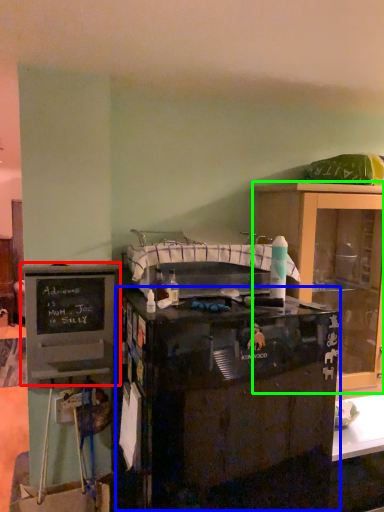
Question: Considering the real-world distances, which object is closest to cabinetry (highlighted by a red box)? desk (highlighted by a blue box) or cabinetry (highlighted by a green box).

Choices:
 (A) desk
 (B) cabinetry

Answer: (A)